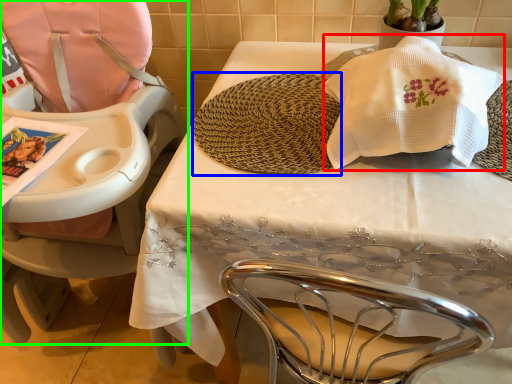
Question: Which is nearer to the blanket (highlighted by a red box)? mat (highlighted by a blue box) or chair (highlighted by a green box).

Choices:
 (A) mat
 (B) chair

Answer: (A)